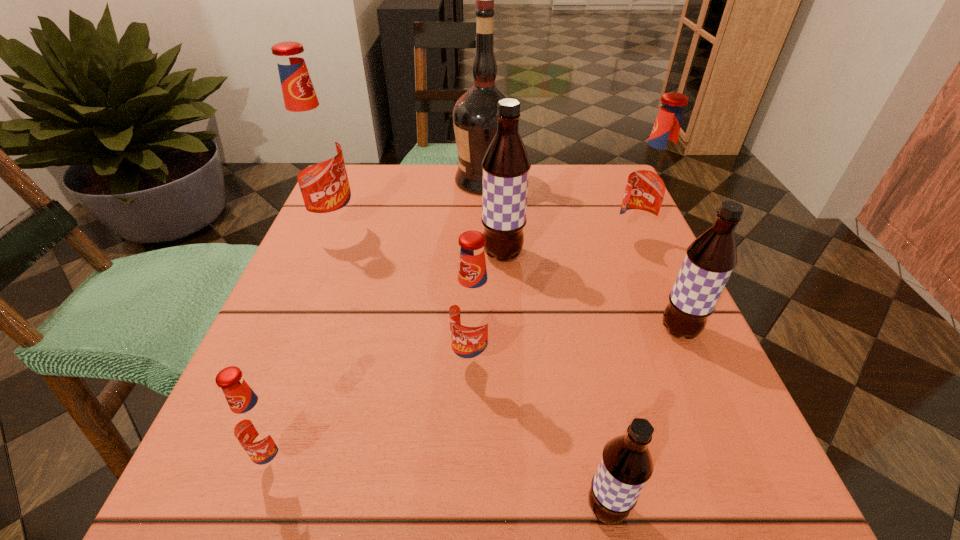
Locate an element on the screen. The width and height of the screenshot is (960, 540). vacant space that satisfies the following two spatial constraints: 1. on the surface of the farthest object; 2. on the right side of the rightmost red root beer is located at coordinates (485, 245).

At what (x,y) coordinates should I click in order to perform the action: click on free space that satisfies the following two spatial constraints: 1. on the surface of the farthest object; 2. on the left side of the second farthest brown root beer. Please return your answer as a coordinate pair (x, y). This screenshot has height=540, width=960. Looking at the image, I should click on (486, 330).

Locate an element on the screen. The width and height of the screenshot is (960, 540). free location that satisfies the following two spatial constraints: 1. on the back side of the leftmost brown root beer; 2. on the left side of the third smallest red root beer is located at coordinates pyautogui.click(x=502, y=245).

You are a GUI agent. You are given a task and a screenshot of the screen. Output one action in this format:
    pyautogui.click(x=<x>, y=<y>)
    Task: Click on the free space that satisfies the following two spatial constraints: 1. on the back side of the rightmost red root beer; 2. on the left side of the nearest object
    The width and height of the screenshot is (960, 540).
    Given the screenshot: What is the action you would take?
    pyautogui.click(x=554, y=245)